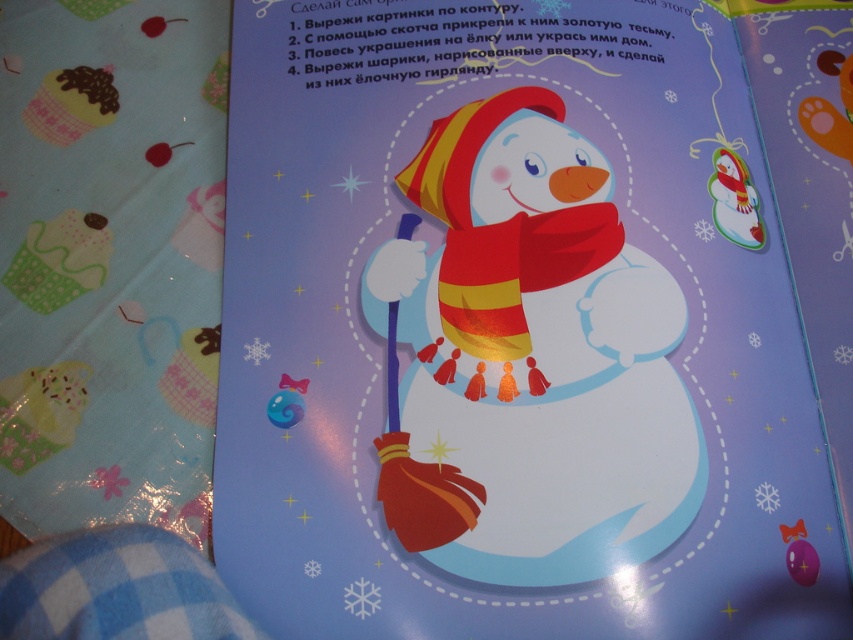
Is point (590, 353) farther from viewer compared to point (569, 232)?

No, (590, 353) is closer to viewer.

Can you confirm if matte paper snowman at center is positioned to the right of yellow/red striped scarf at center?

Correct, you'll find matte paper snowman at center to the right of yellow/red striped scarf at center.

Looking at this image, who is more distant from viewer, [740,140] or [543,268]?

The point [740,140] is behind.

Locate an element on the screen. Image resolution: width=853 pixels, height=640 pixels. matte paper snowman at center is located at coordinates (537, 317).

In the scene shown: Is matte red scarf at center smaller than yellow/red striped scarf at center?

Actually, matte red scarf at center might be larger than yellow/red striped scarf at center.

Does matte red scarf at center have a greater height compared to yellow/red striped scarf at center?

Correct, matte red scarf at center is much taller as yellow/red striped scarf at center.

Who is more distant from viewer, (434, 481) or (583, 230)?

Point (583, 230)

Find the location of a particular element. The height and width of the screenshot is (640, 853). matte red scarf at center is located at coordinates (527, 358).

Can you confirm if matte paper snowman at center is positioned to the left of matte red scarf at center?

Incorrect, matte paper snowman at center is not on the left side of matte red scarf at center.

Who is taller, matte paper snowman at center or matte red scarf at center?

matte paper snowman at center is taller.

Who is more distant from viewer, (671,513) or (566,131)?

Positioned behind is point (566,131).

I want to click on matte paper snowman at center, so click(537, 317).